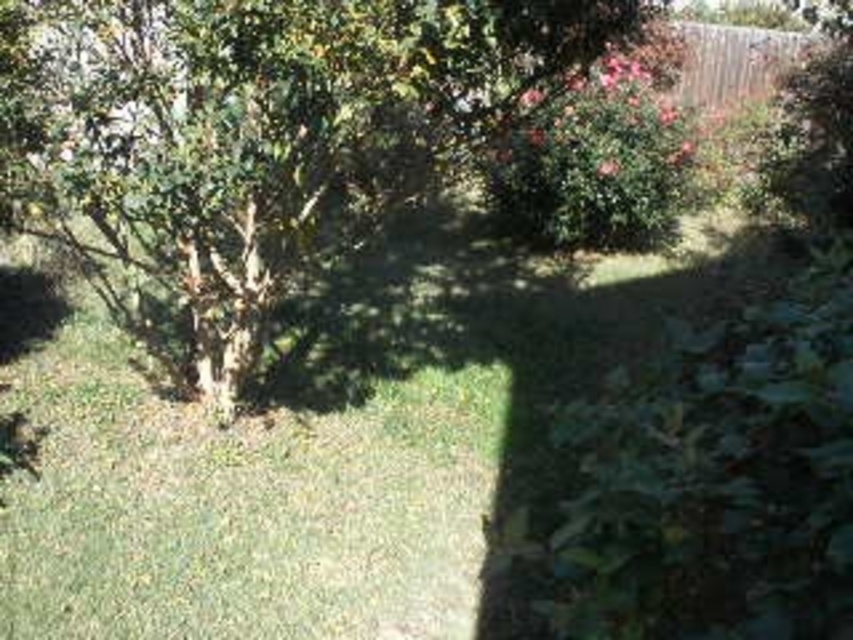
Between green leafy tree at center and green leafy bush at upper center, which one appears on the left side from the viewer's perspective?

green leafy tree at center is more to the left.

Does green leafy tree at center come behind green leafy bush at upper center?

→ No, it is not.

Identify the location of green leafy tree at center. (260, 129).